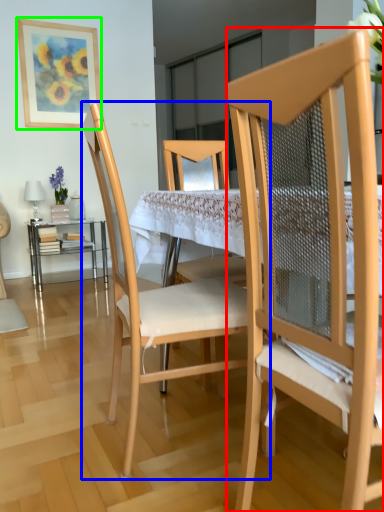
Question: Estimate the real-world distances between objects in this image. Which object is farther from chair (highlighted by a red box), chair (highlighted by a blue box) or picture frame (highlighted by a green box)?

Choices:
 (A) chair
 (B) picture frame

Answer: (B)